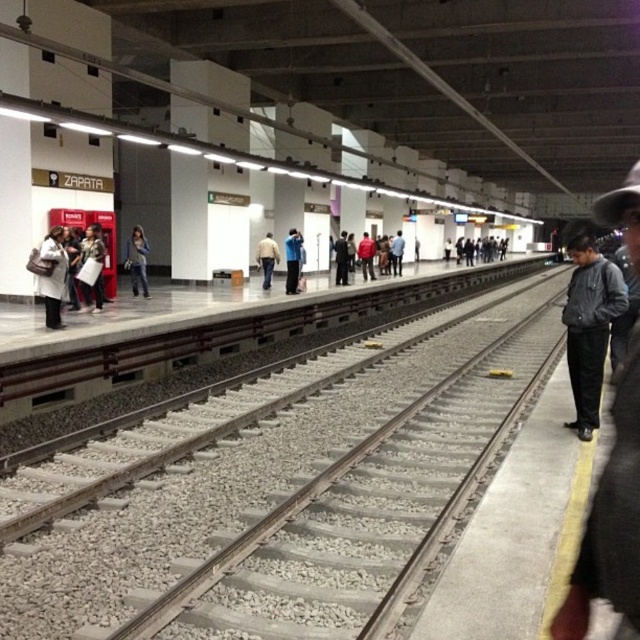
You are standing on the ZAPATA subway platform and notice two coats hanging on a rack near the red ticket vending machine. The coats are the white fabric coat at left and the matte black jacket at left. Which coat is shorter in height?

The white fabric coat at left is shorter in height compared to the matte black jacket at left.

You are a subway passenger who wants to move from the matte black jacket at left to the dark gray jacket at right. Is the path between them wide enough for you to walk through comfortably?

The dark gray jacket at right might be wider than matte black jacket at left, so the path between them may not be wide enough for comfortable passage. It is recommended to check the actual space before moving.